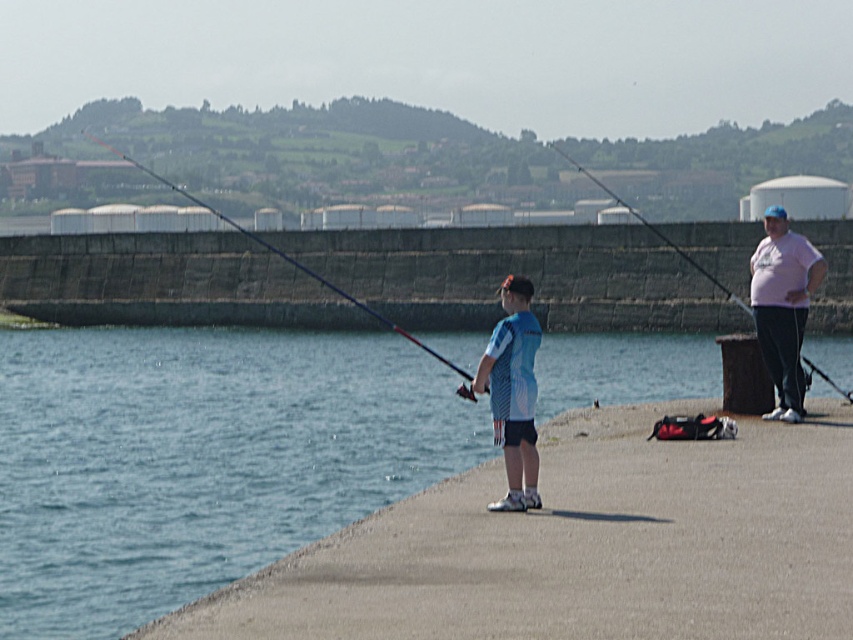
Is point (508, 497) closer to viewer compared to point (257, 241)?

Yes, it is in front of point (257, 241).

Is point (509, 364) farther from camera compared to point (456, 365)?

No, (509, 364) is in front of (456, 365).

Image resolution: width=853 pixels, height=640 pixels. In order to click on blue matte shirt at center in this screenshot , I will do `click(512, 392)`.

Where is `blue matte shirt at center`? Image resolution: width=853 pixels, height=640 pixels. blue matte shirt at center is located at coordinates (512, 392).

Does blue water at lower left lie in front of matte blue fishing pole at center?

Yes, blue water at lower left is closer to the viewer.

Does blue water at lower left appear over matte blue fishing pole at center?

No, blue water at lower left is not above matte blue fishing pole at center.

Describe the element at coordinates (190, 458) in the screenshot. Image resolution: width=853 pixels, height=640 pixels. I see `blue water at lower left` at that location.

What are the coordinates of `blue water at lower left` in the screenshot? It's located at click(190, 458).

Which is below, matte blue fishing pole at center or matte black fishing pole at right?

Positioned lower is matte blue fishing pole at center.

Measure the distance between point (431,348) and camera.

A distance of 61.07 meters exists between point (431,348) and camera.

Which is in front, point (177, 192) or point (743, 308)?

Positioned in front is point (743, 308).

Find the location of a particular element. This screenshot has width=853, height=640. matte blue fishing pole at center is located at coordinates tap(283, 257).